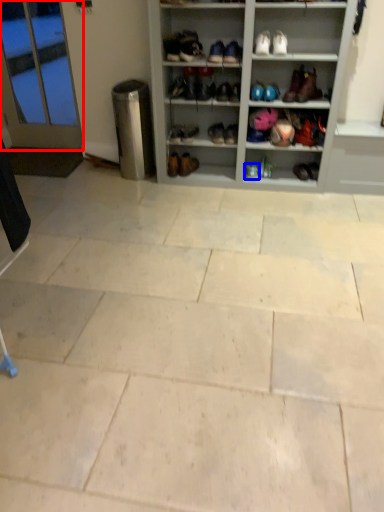
Question: Which object appears closest to the camera in this image, glass door (highlighted by a red box) or footwear (highlighted by a blue box)?

Choices:
 (A) glass door
 (B) footwear

Answer: (B)